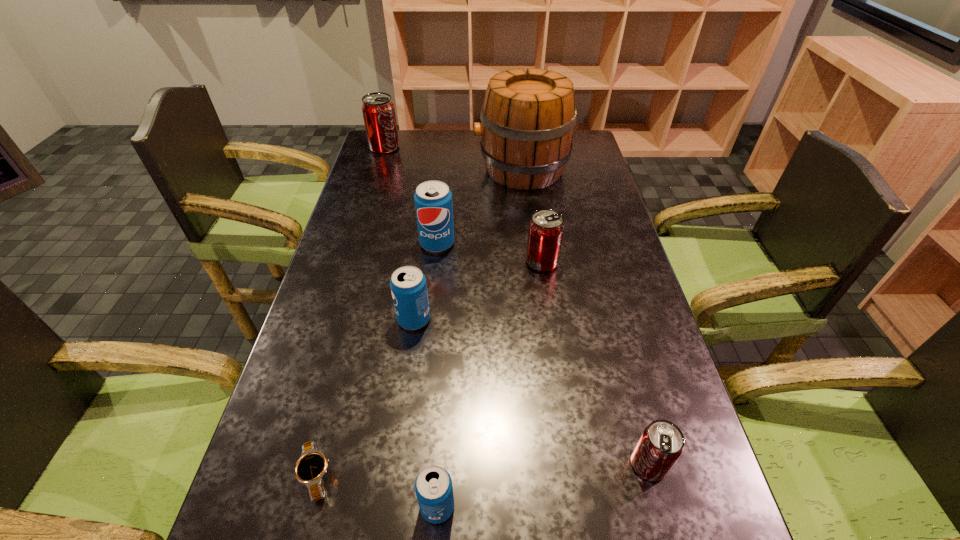
Locate an element on the screen. Image resolution: width=960 pixels, height=540 pixels. the tallest object is located at coordinates coord(528,118).

Locate an element on the screen. The image size is (960, 540). the farthest red pop soda is located at coordinates (378, 110).

You are a GUI agent. You are given a task and a screenshot of the screen. Output one action in this format:
    pyautogui.click(x=<x>, y=<y>)
    Task: Click on the leftmost red pop soda
    The width and height of the screenshot is (960, 540).
    Given the screenshot: What is the action you would take?
    pyautogui.click(x=378, y=110)

Find the location of a particular element. Image resolution: width=960 pixels, height=540 pixels. the biggest blue soda can is located at coordinates (433, 200).

Identify the location of the second farthest blue soda can. The width and height of the screenshot is (960, 540). (408, 285).

Locate an element on the screen. the second smallest blue soda can is located at coordinates (408, 285).

Image resolution: width=960 pixels, height=540 pixels. Find the location of `the second nearest red pop soda`. the second nearest red pop soda is located at coordinates 546,228.

In order to click on the second biggest red pop soda in this screenshot , I will do `click(546, 228)`.

Locate an element on the screen. The height and width of the screenshot is (540, 960). the nearest red pop soda is located at coordinates (661, 444).

The width and height of the screenshot is (960, 540). What are the coordinates of `the rightmost soda can` in the screenshot? It's located at (661, 444).